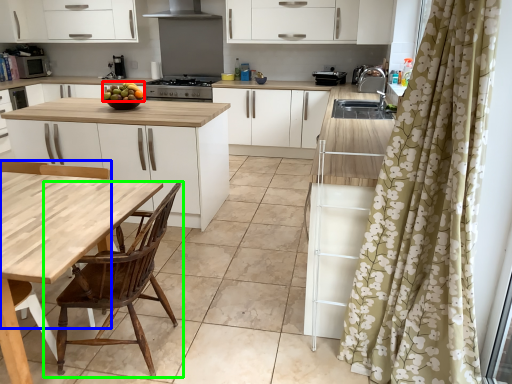
Question: Which object is positioned farthest from fruit (highlighted by a red box)? Select from chair (highlighted by a blue box) and chair (highlighted by a green box).

Choices:
 (A) chair
 (B) chair

Answer: (B)